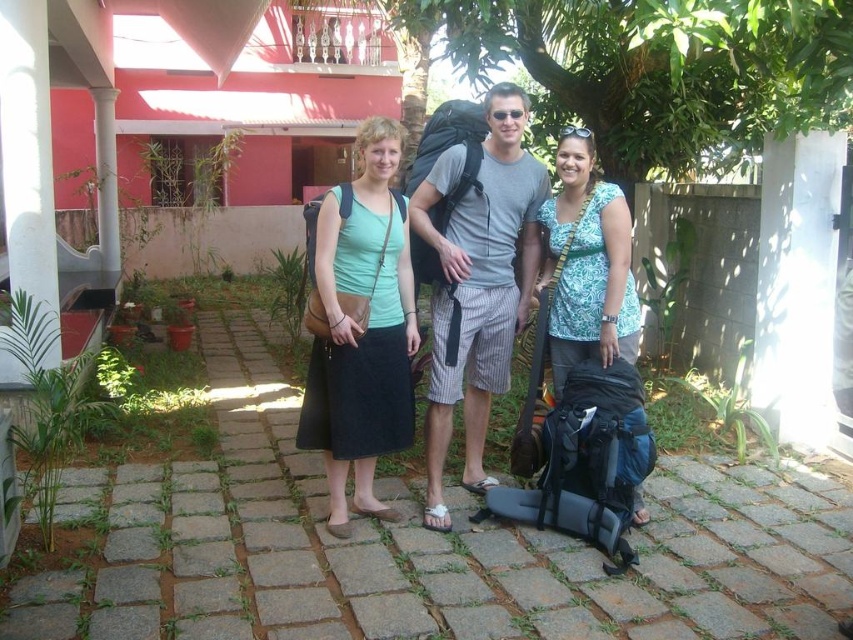
Can you confirm if matte green tank top at center is positioned to the left of printed fabric shirt at center?

Correct, you'll find matte green tank top at center to the left of printed fabric shirt at center.

Does matte green tank top at center appear on the right side of printed fabric shirt at center?

No, matte green tank top at center is not to the right of printed fabric shirt at center.

Does point (396, 333) come in front of point (560, 358)?

Yes, it is.

This screenshot has width=853, height=640. Find the location of `matte green tank top at center`. matte green tank top at center is located at coordinates [x=361, y=326].

In order to click on matte black backpack at center in this screenshot , I will do click(476, 278).

This screenshot has height=640, width=853. In order to click on matte black backpack at center in this screenshot , I will do `click(476, 278)`.

Where is `matte black backpack at center`? matte black backpack at center is located at coordinates (476, 278).

Based on the photo, is matte black backpack at center closer to the viewer compared to matte green tank top at center?

No, matte black backpack at center is further to the viewer.

Does matte black backpack at center appear over matte green tank top at center?

Yes, matte black backpack at center is above matte green tank top at center.

Is point (450, 369) positioned behind point (357, 435)?

Yes.

What are the coordinates of `matte black backpack at center` in the screenshot? It's located at (476, 278).